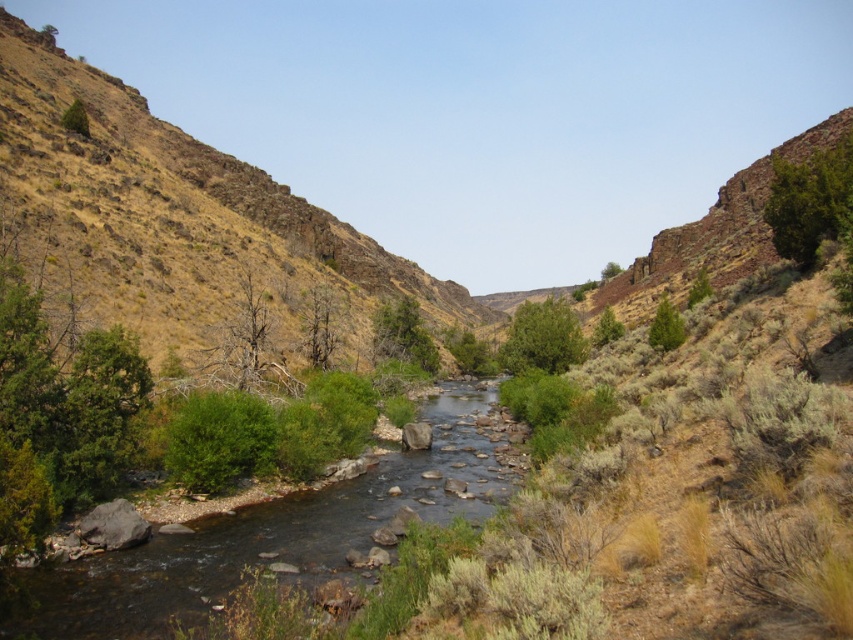
Can you confirm if green leafy shrub at upper center is smaller than green leafy shrub at upper left?

No.

Is point (670, 316) in front of point (80, 113)?

Yes.

What are the coordinates of `green leafy shrub at upper center` in the screenshot? It's located at (666, 326).

Who is higher up, green leafy bush at center or green leafy shrub at upper center?

Positioned higher is green leafy shrub at upper center.

Can you confirm if green leafy bush at center is shorter than green leafy shrub at upper center?

No.

What are the coordinates of `green leafy bush at center` in the screenshot? It's located at (543, 339).

Does green leafy bush at center appear under green leafy shrub at upper left?

Correct, green leafy bush at center is located below green leafy shrub at upper left.

Does green leafy bush at center appear over green leafy shrub at upper left?

Incorrect, green leafy bush at center is not positioned above green leafy shrub at upper left.

The width and height of the screenshot is (853, 640). Find the location of `green leafy bush at center`. green leafy bush at center is located at coordinates (543, 339).

I want to click on green leafy bush at center, so click(543, 339).